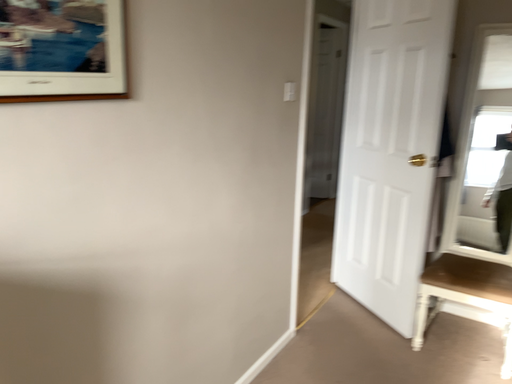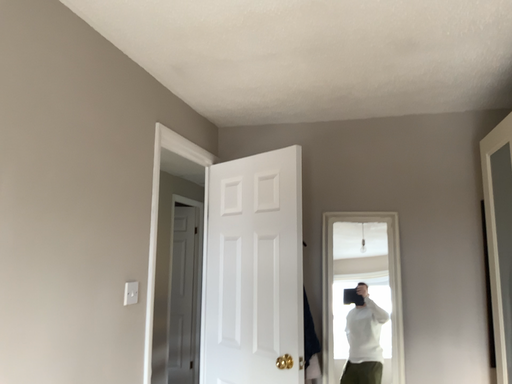
Question: How did the camera likely rotate when shooting the video?

Choices:
 (A) rotated right
 (B) rotated left

Answer: (A)